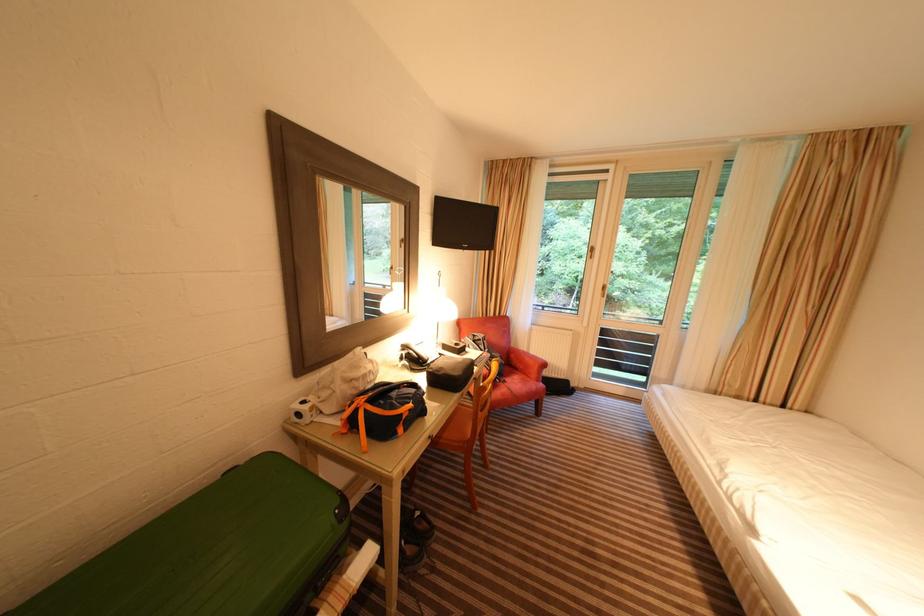
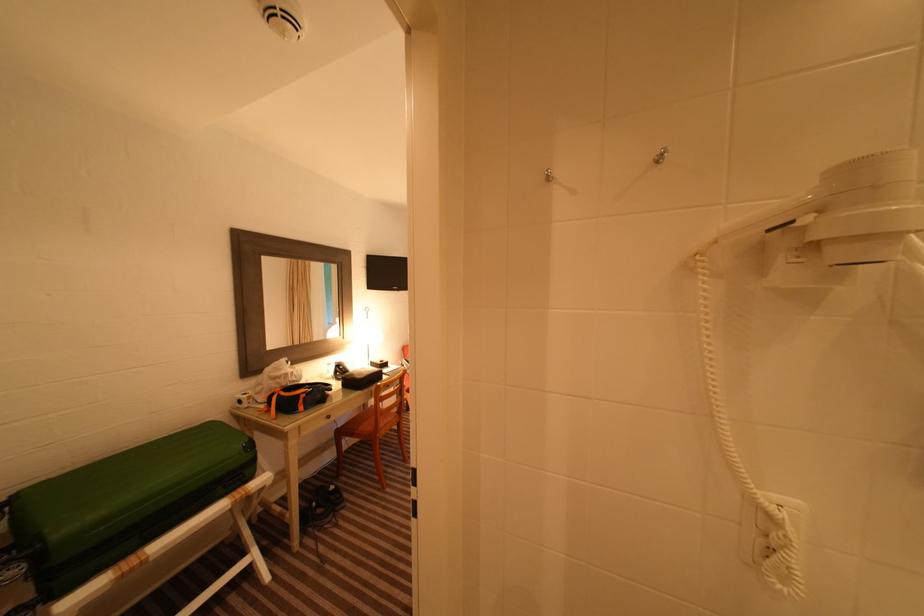
What movement of the cameraman would produce the second image?

The movement direction of the cameraman is right, backward.